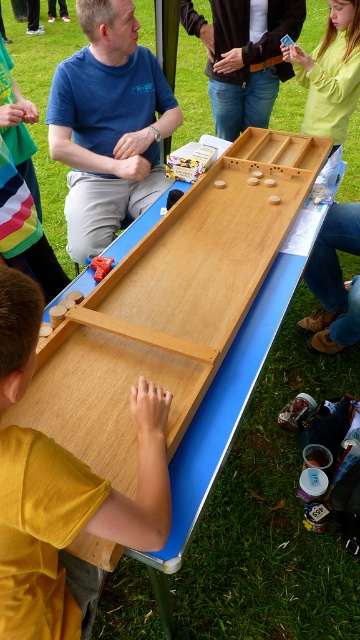
Question: Is wooden board game at lower left positioned before matte blue shirt at upper left?

Choices:
 (A) no
 (B) yes

Answer: (B)

Question: Which point is farther to the camera?

Choices:
 (A) denim jeans at center
 (B) wooden board game at lower left
 (C) wooden board at center

Answer: (A)

Question: Among these points, which one is nearest to the camera?

Choices:
 (A) (106, 257)
 (B) (75, 109)
 (C) (61, 451)
 (D) (147, 332)

Answer: (C)

Question: Is denim jeans at center below wooden game board at center?

Choices:
 (A) no
 (B) yes

Answer: (A)

Question: Does matte blue shirt at upper left appear on the left side of wooden game board at center?

Choices:
 (A) no
 (B) yes

Answer: (B)

Question: Which object is positioned closest to the light yellow sweater at upper right?

Choices:
 (A) denim jeans at center
 (B) wooden board at center
 (C) wooden game board at center
 (D) wooden board game at lower left

Answer: (A)